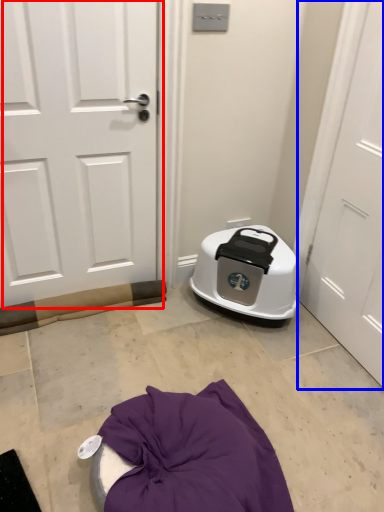
Question: Which object is further to the camera taking this photo, door (highlighted by a red box) or door (highlighted by a blue box)?

Choices:
 (A) door
 (B) door

Answer: (A)